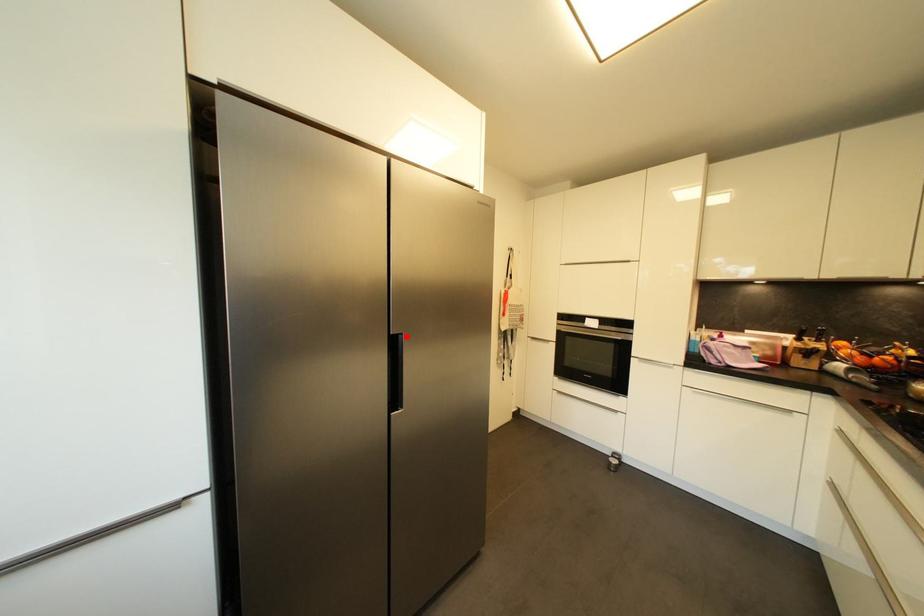
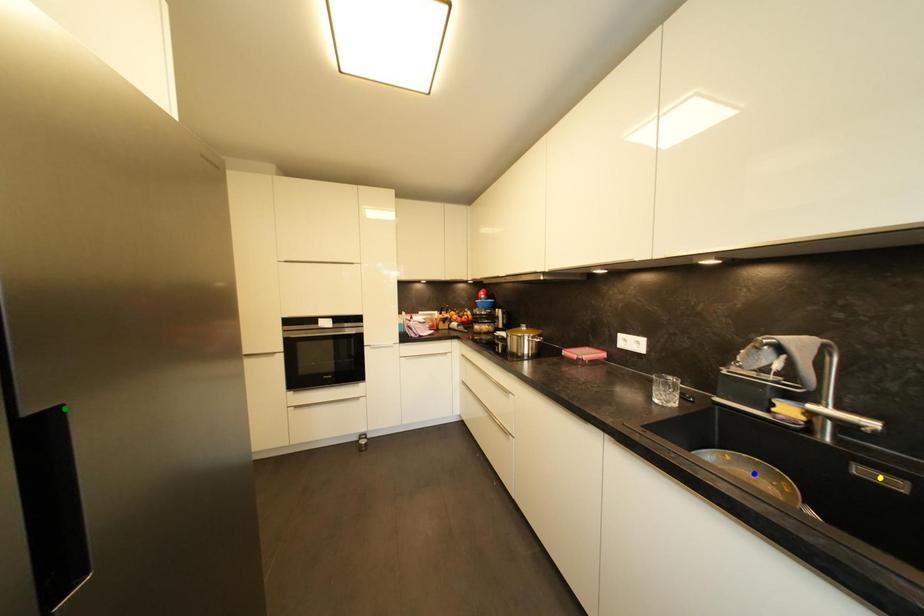
Question: I am providing you with two images of the same scene from different viewpoints. A red point is marked on the first image. You are given multiple points on the second image. In image 2, which mark is for the same physical point as the one in image 1?

Choices:
 (A) yellow point
 (B) blue point
 (C) green point

Answer: (C)